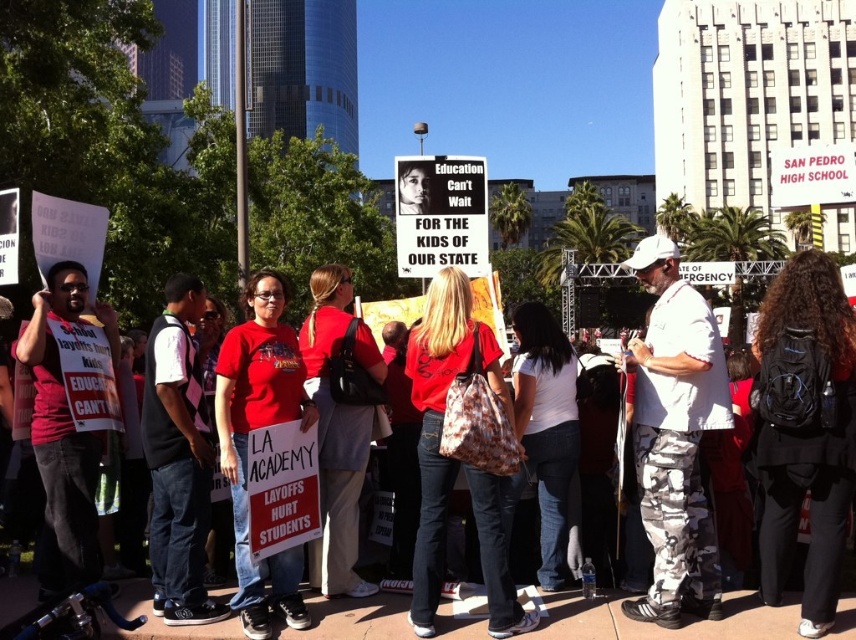
Question: Among these objects, which one is nearest to the camera?

Choices:
 (A) matte red shirt at center
 (B) white camouflage pants at center

Answer: (A)

Question: Which point appears closest to the camera in this image?

Choices:
 (A) (104, 432)
 (B) (639, 499)

Answer: (B)

Question: Is white camouflage pants at center positioned in front of matte red shirt at center?

Choices:
 (A) no
 (B) yes

Answer: (A)

Question: Is white camouflage pants at center positioned before matte red shirt at center?

Choices:
 (A) yes
 (B) no

Answer: (B)

Question: Observing the image, what is the correct spatial positioning of white camouflage pants at center in reference to matte red shirt at center?

Choices:
 (A) above
 (B) below

Answer: (A)